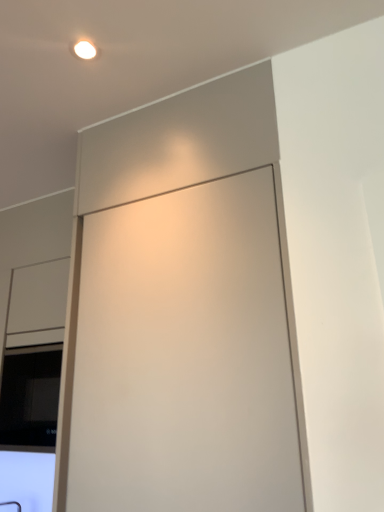
Question: Considering the relative sizes of matte white cabinet at center and black glass window at lower left in the image provided, is matte white cabinet at center bigger than black glass window at lower left?

Choices:
 (A) no
 (B) yes

Answer: (B)

Question: Is matte white cabinet at center positioned beyond the bounds of black glass window at lower left?

Choices:
 (A) no
 (B) yes

Answer: (B)

Question: Is matte white cabinet at center closer to the viewer compared to black glass window at lower left?

Choices:
 (A) no
 (B) yes

Answer: (B)

Question: From a real-world perspective, is matte white cabinet at center below black glass window at lower left?

Choices:
 (A) no
 (B) yes

Answer: (A)

Question: Does matte white cabinet at center have a lesser width compared to black glass window at lower left?

Choices:
 (A) yes
 (B) no

Answer: (B)

Question: Does matte white cabinet at center appear on the right side of black glass window at lower left?

Choices:
 (A) no
 (B) yes

Answer: (B)

Question: Is black glass window at lower left wider than matte white cabinet at center?

Choices:
 (A) no
 (B) yes

Answer: (A)

Question: Is black glass window at lower left at the left side of matte white cabinet at center?

Choices:
 (A) yes
 (B) no

Answer: (A)

Question: Is black glass window at lower left next to matte white cabinet at center and touching it?

Choices:
 (A) yes
 (B) no

Answer: (B)

Question: From a real-world perspective, does black glass window at lower left stand above matte white cabinet at center?

Choices:
 (A) yes
 (B) no

Answer: (B)

Question: Does black glass window at lower left have a larger size compared to matte white cabinet at center?

Choices:
 (A) no
 (B) yes

Answer: (A)

Question: Can you confirm if black glass window at lower left is thinner than matte white cabinet at center?

Choices:
 (A) yes
 (B) no

Answer: (A)

Question: In terms of height, does matte white cabinet at center look taller or shorter compared to black glass window at lower left?

Choices:
 (A) short
 (B) tall

Answer: (B)